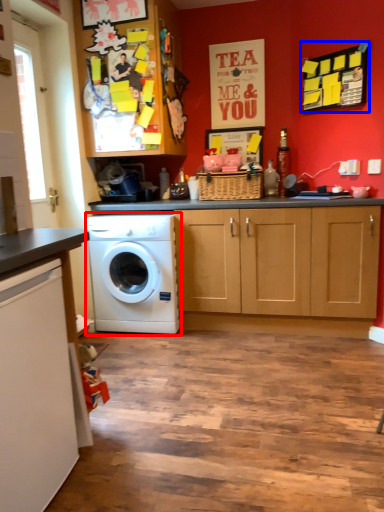
Question: Which point is closer to the camera, washing machine (highlighted by a red box) or bulletin board (highlighted by a blue box)?

Choices:
 (A) washing machine
 (B) bulletin board

Answer: (B)